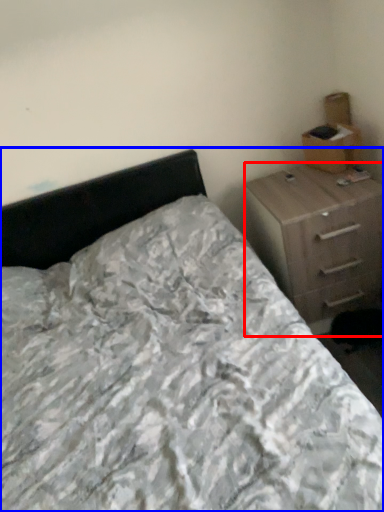
Question: Which of the following is the farthest to the observer, chest of drawers (highlighted by a red box) or bed (highlighted by a blue box)?

Choices:
 (A) chest of drawers
 (B) bed

Answer: (A)